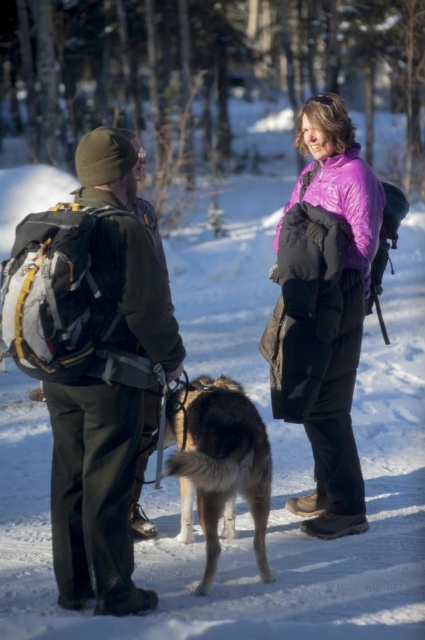
Question: Which of the following is the closest to the observer?

Choices:
 (A) purple down jacket at center
 (B) purple fleece jacket at center
 (C) fluffy brown dog at center
 (D) green fabric jacket at left

Answer: (D)

Question: Can you confirm if green fabric jacket at left is positioned to the left of purple down jacket at center?

Choices:
 (A) yes
 (B) no

Answer: (A)

Question: Which of these objects is positioned closest to the fluffy brown dog at center?

Choices:
 (A) purple down jacket at center
 (B) purple fleece jacket at center

Answer: (A)

Question: Considering the real-world distances, which object is closest to the fluffy brown dog at center?

Choices:
 (A) purple fleece jacket at center
 (B) purple down jacket at center

Answer: (B)

Question: Is green fabric jacket at left above purple fleece jacket at center?

Choices:
 (A) yes
 (B) no

Answer: (B)

Question: Is green fabric jacket at left wider than purple fleece jacket at center?

Choices:
 (A) yes
 (B) no

Answer: (B)